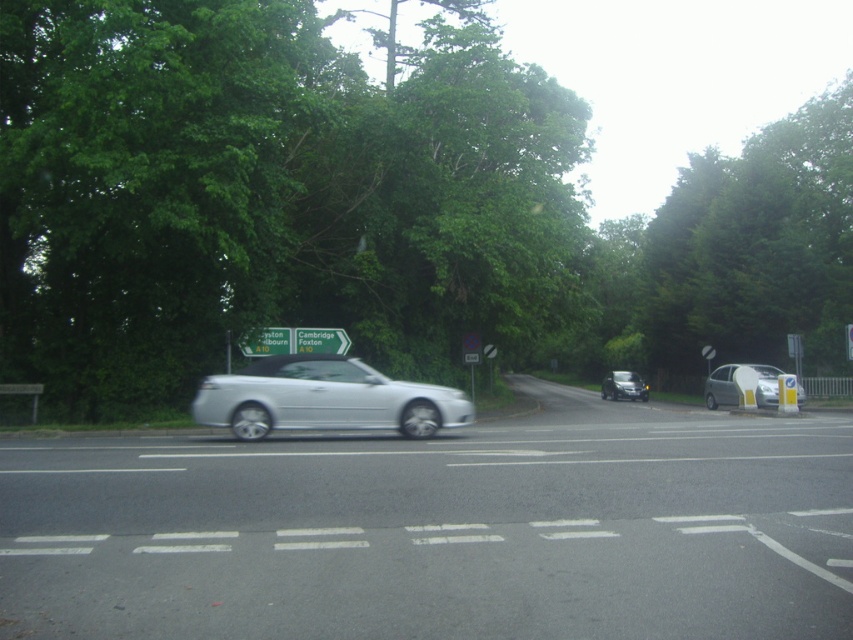
Question: From the image, what is the correct spatial relationship of silver metallic car at center in relation to green plastic sign at center?

Choices:
 (A) left
 (B) right

Answer: (B)

Question: Which point is closer to the camera?

Choices:
 (A) green plastic signpost at upper center
 (B) green plastic sign at center

Answer: (A)

Question: Can you confirm if silver metallic hatchback at right is positioned to the left of green plastic sign at center?

Choices:
 (A) no
 (B) yes

Answer: (A)

Question: Among these objects, which one is nearest to the camera?

Choices:
 (A) green plastic sign at center
 (B) metallic silver car at center

Answer: (A)

Question: Can you confirm if silver metallic car at center is bigger than green plastic sign at center?

Choices:
 (A) no
 (B) yes

Answer: (A)

Question: Which point is farther to the camera?

Choices:
 (A) (349, 342)
 (B) (727, 403)
 (C) (631, 387)
 (D) (339, 424)

Answer: (C)